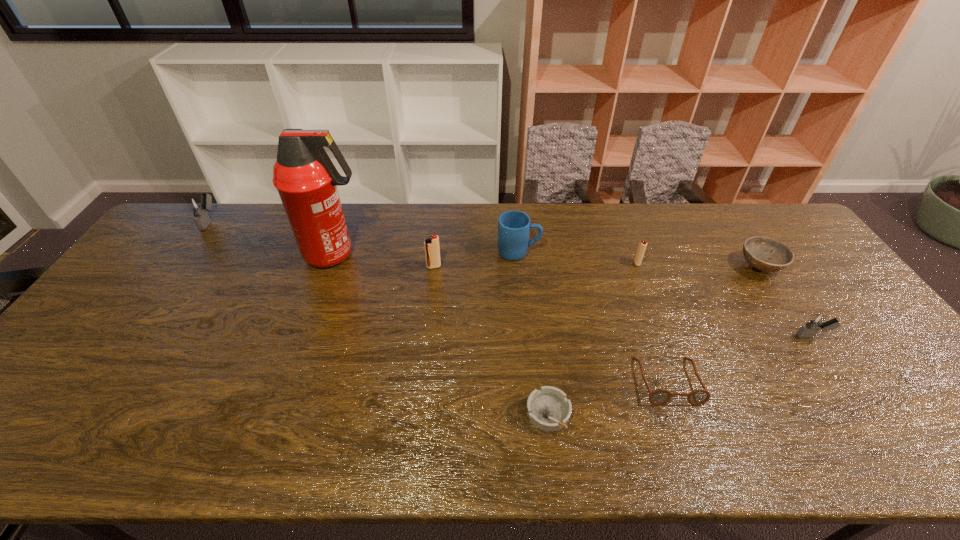
Where is `bowl situated at the right edge`? The width and height of the screenshot is (960, 540). bowl situated at the right edge is located at coordinates (757, 250).

Image resolution: width=960 pixels, height=540 pixels. I want to click on object at the far left corner, so click(x=199, y=206).

Where is `free region at the far edge of the desktop`? free region at the far edge of the desktop is located at coordinates (713, 221).

I want to click on free space at the near edge, so click(586, 440).

Locate an element on the screen. The width and height of the screenshot is (960, 540). free space at the left edge of the desktop is located at coordinates (47, 387).

You are a GUI agent. You are given a task and a screenshot of the screen. Output one action in this format:
    pyautogui.click(x=<x>, y=<y>)
    Task: Click on the blank area at the right edge
    The width and height of the screenshot is (960, 540).
    Given the screenshot: What is the action you would take?
    pyautogui.click(x=826, y=281)

Image resolution: width=960 pixels, height=540 pixels. In the image, there is a desktop. Find the location of `vacant space at the near left corner`. vacant space at the near left corner is located at coordinates (58, 453).

The height and width of the screenshot is (540, 960). What are the coordinates of `vacant space at the far right corner of the desktop` in the screenshot? It's located at (773, 233).

This screenshot has width=960, height=540. What are the coordinates of `vacant space at the near right corner` in the screenshot? It's located at 946,456.

You are a GUI agent. You are given a task and a screenshot of the screen. Output one action in this format:
    pyautogui.click(x=<x>, y=<y>)
    Task: Click on the free spot between the blue mug and the nearer gray igniter
    The width and height of the screenshot is (960, 540).
    Given the screenshot: What is the action you would take?
    666,294